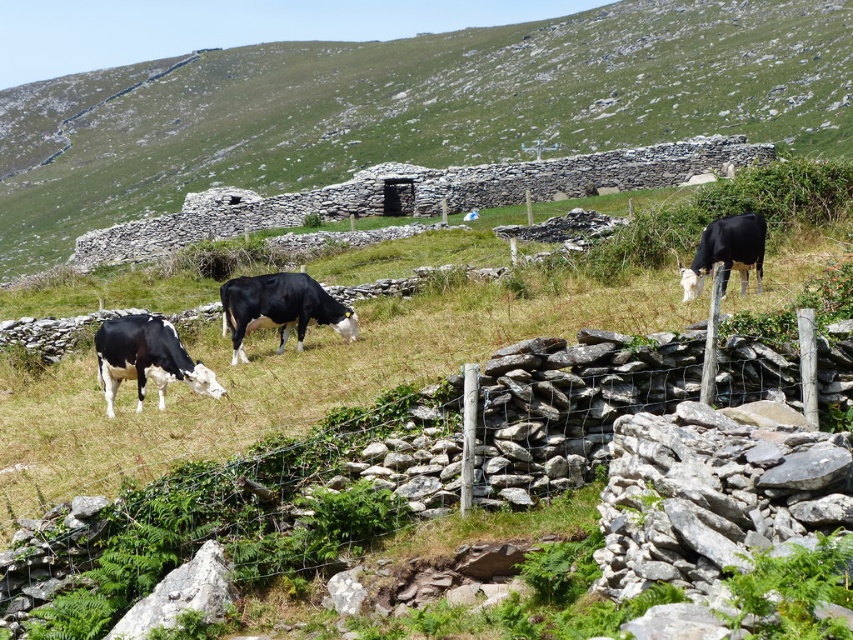
Question: Can you confirm if black cow at center is smaller than wire mesh fence at lower left?

Choices:
 (A) no
 (B) yes

Answer: (A)

Question: Which object appears closest to the camera in this image?

Choices:
 (A) black glossy cow at center
 (B) black glossy cow at right
 (C) black glossy cow at lower left

Answer: (B)

Question: Considering the real-world distances, which object is farthest from the black glossy cow at lower left?

Choices:
 (A) black glossy cow at right
 (B) wire mesh fence at lower left
 (C) black cow at center
 (D) black glossy cow at center

Answer: (C)

Question: Does black glossy cow at lower left appear under black glossy cow at right?

Choices:
 (A) no
 (B) yes

Answer: (B)

Question: Does wire mesh fence at lower left have a lesser width compared to black glossy cow at right?

Choices:
 (A) no
 (B) yes

Answer: (A)

Question: Which point appears farthest from the camera in this image?

Choices:
 (A) (729, 225)
 (B) (653, 86)

Answer: (B)